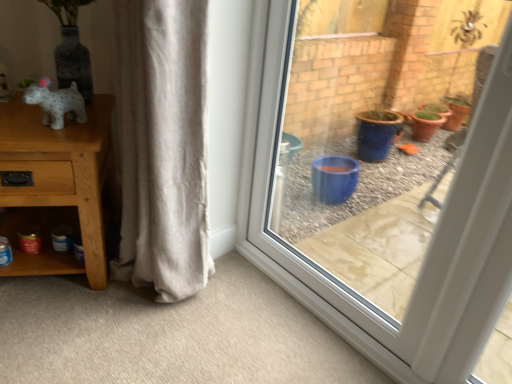
The width and height of the screenshot is (512, 384). What are the coordinates of `vacant space in front of beige cotton curtain at center` in the screenshot? It's located at click(142, 334).